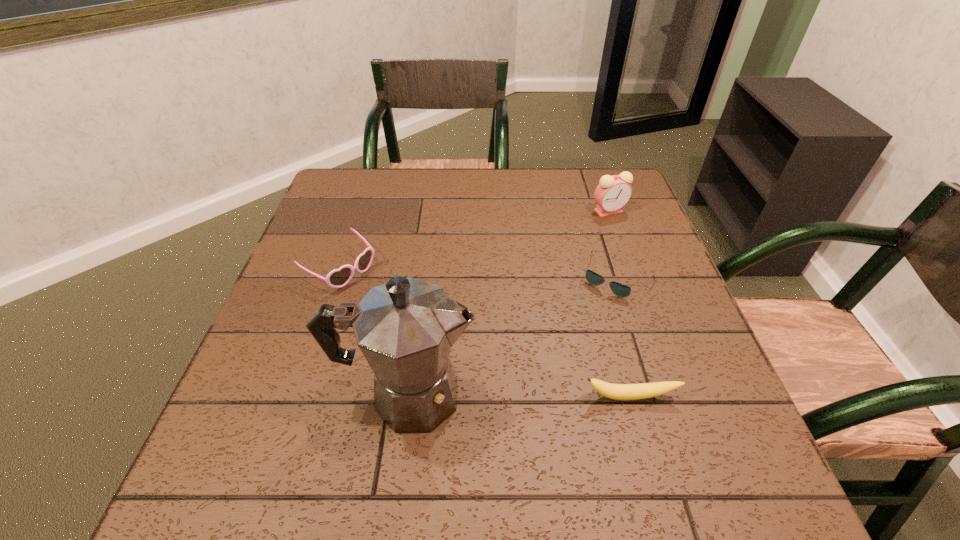
The width and height of the screenshot is (960, 540). I want to click on free space between the shortest object and the coffeepot, so click(x=512, y=336).

Locate an element on the screen. vacant point located between the farthest object and the banana is located at coordinates (619, 304).

At what (x,y) coordinates should I click in order to perform the action: click on free space that is in between the fourth shortest object and the shorter sunglasses. Please return your answer as a coordinate pair (x, y). Looking at the image, I should click on (612, 244).

Locate which object ranks second in proximity to the tallest object. Please provide its 2D coordinates. Your answer should be formatted as a tuple, i.e. [(x, y)], where the tuple contains the x and y coordinates of a point satisfying the conditions above.

[(644, 390)]

The image size is (960, 540). I want to click on object that stands as the second closest to the farthest object, so tap(644, 390).

Where is `vacant space that satisfies the following two spatial constraints: 1. on the front side of the shortest object; 2. on the left side of the taller sunglasses`? vacant space that satisfies the following two spatial constraints: 1. on the front side of the shortest object; 2. on the left side of the taller sunglasses is located at coordinates (338, 276).

Where is `free space that satisfies the following two spatial constraints: 1. on the back side of the taller sunglasses; 2. on the left side of the farthest object`? This screenshot has height=540, width=960. free space that satisfies the following two spatial constraints: 1. on the back side of the taller sunglasses; 2. on the left side of the farthest object is located at coordinates (359, 211).

Where is `vacant space that satisfies the following two spatial constraints: 1. on the front side of the tallest object; 2. on the pouring side of the left sunglasses`? The height and width of the screenshot is (540, 960). vacant space that satisfies the following two spatial constraints: 1. on the front side of the tallest object; 2. on the pouring side of the left sunglasses is located at coordinates (298, 395).